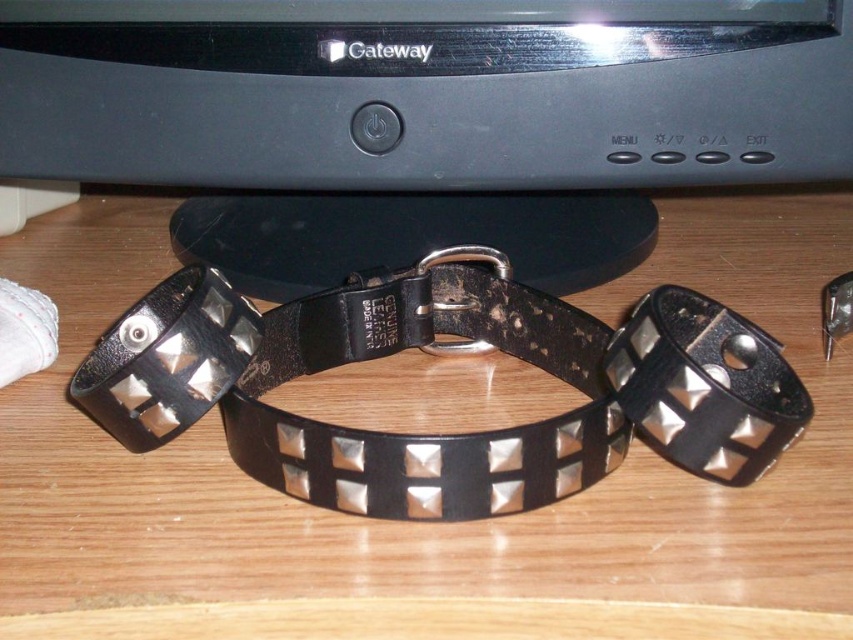
You are a customer at a jewelry store and see the black leather studded bracelet at center. The store has a policy that bracelets must be at least 18 inches apart for display purposes. Does this bracelet meet the requirement?

The black leather studded bracelet at center is 18.22 inches apart, which exceeds the store requirement of 18 inches. Therefore, it meets the requirement.

You are organizing a jewelry display and need to place the black leather studded bracelet at center and the black leather bracelet at center on a shelf. Which bracelet should you place first if you want to arrange them from narrowest to widest?

The black leather studded bracelet at center should be placed first because it has a lesser width compared to the black leather bracelet at center.

You are organizing items on a desk and need to place a new item between the black plastic monitor at center and the black leather bracelet at center. Which item should be placed closer to you to maintain the current arrangement?

The black plastic monitor at center is closer to you than the black leather bracelet at center, so place the new item between them closer to the black plastic monitor at center to maintain the current arrangement.